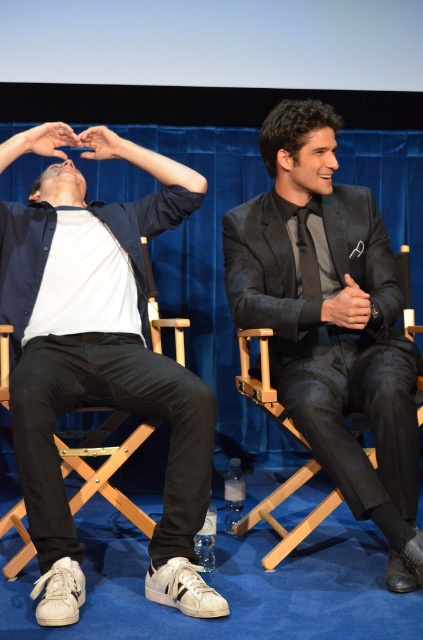
Question: Which point is farther to the camera?

Choices:
 (A) (30, 529)
 (B) (351, 314)
 (C) (109, 145)
 (D) (236, 228)

Answer: (C)

Question: Can you confirm if white leather sneakers at lower left is positioned to the right of matte white hand at upper center?

Choices:
 (A) yes
 (B) no

Answer: (A)

Question: Which of the following is the closest to the observer?

Choices:
 (A) matte white hand at upper left
 (B) matte black hand at center

Answer: (B)

Question: Which object is farther from the camera taking this photo?

Choices:
 (A) matte white hand at upper left
 (B) matte white hand at upper center

Answer: (A)

Question: Is white leather sneakers at lower left smaller than matte white hand at upper left?

Choices:
 (A) no
 (B) yes

Answer: (A)

Question: Where is matte black hand at center located in relation to matte white hand at upper left in the image?

Choices:
 (A) below
 (B) above

Answer: (A)